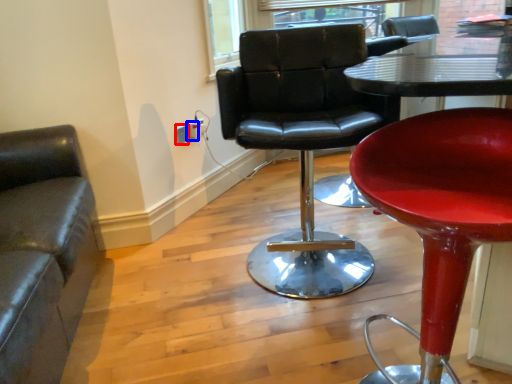
Question: Among these objects, which one is farthest to the camera, electric outlet (highlighted by a red box) or electric outlet (highlighted by a blue box)?

Choices:
 (A) electric outlet
 (B) electric outlet

Answer: (B)